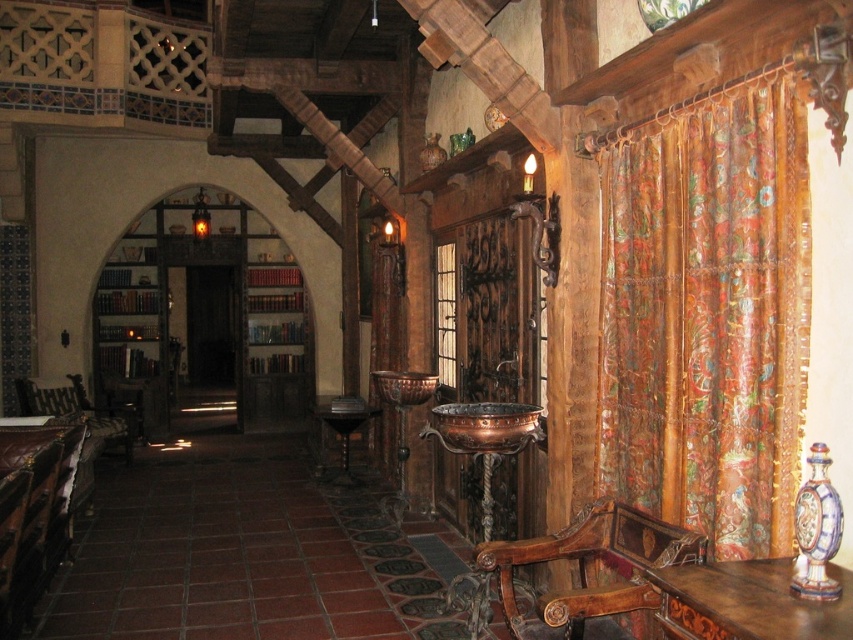
How much distance is there between floral silk curtain at right and wooden table at center?

A distance of 4.92 meters exists between floral silk curtain at right and wooden table at center.

Is point (775, 307) less distant than point (347, 476)?

That is True.

The width and height of the screenshot is (853, 640). Identify the location of floral silk curtain at right. (708, 316).

I want to click on floral silk curtain at right, so click(708, 316).

Which of these two, copper/bronze sink at center or wooden table at center, stands shorter?

copper/bronze sink at center is shorter.

Can you confirm if copper/bronze sink at center is positioned above wooden table at center?

Yes.

Is point (517, 410) in front of point (331, 420)?

Yes, it is.

Find the location of a particular element. The height and width of the screenshot is (640, 853). copper/bronze sink at center is located at coordinates (485, 426).

Who is positioned more to the right, polished wood chair at center or copper/bronze sink at center?

Positioned to the right is polished wood chair at center.

Between point (605, 586) and point (509, 408), which one is positioned behind?

Point (509, 408)

This screenshot has width=853, height=640. In order to click on polished wood chair at center in this screenshot , I will do `click(589, 572)`.